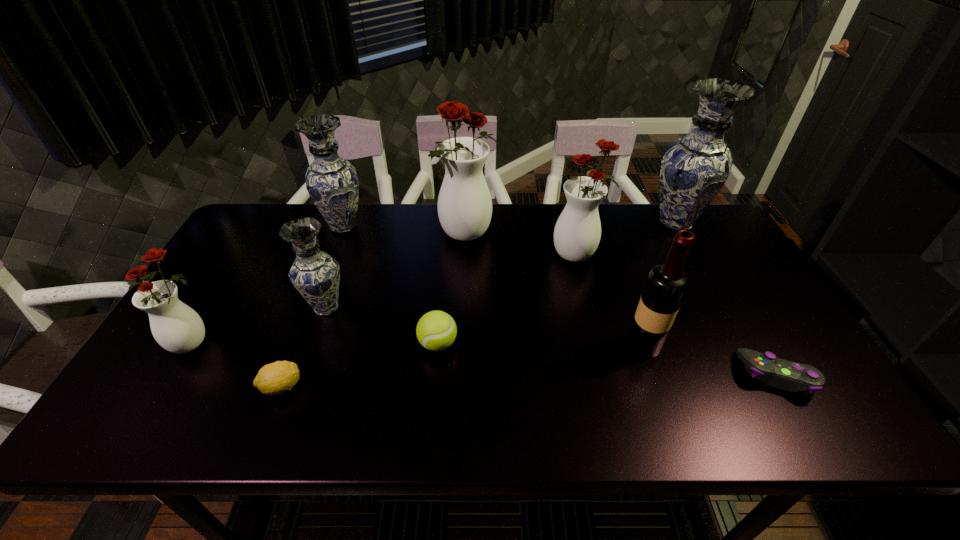
Find the location of a particular element. the nearest vase is located at coordinates (176, 327).

The image size is (960, 540). I want to click on the leftmost red vase, so click(176, 327).

This screenshot has width=960, height=540. Identify the location of the third shortest object. [x=436, y=330].

The image size is (960, 540). I want to click on tennis ball, so click(436, 330).

Image resolution: width=960 pixels, height=540 pixels. I want to click on lemon, so click(x=275, y=378).

Find the location of a particular element. gray control is located at coordinates (790, 376).

Identify the location of vacant space located on the front of the rightmost vase. (703, 274).

You are a GUI agent. You are given a task and a screenshot of the screen. Output one action in this format:
    pyautogui.click(x=<x>, y=<y>)
    Task: Click on the blank space located on the front of the second red vase from left to right
    The height and width of the screenshot is (540, 960).
    Given the screenshot: What is the action you would take?
    pyautogui.click(x=463, y=300)

The width and height of the screenshot is (960, 540). In order to click on vacant region located on the front of the second biggest blue vase in this screenshot , I will do `click(308, 323)`.

Identify the location of vacant point located 0.400m on the left of the second vase from right to left. (422, 255).